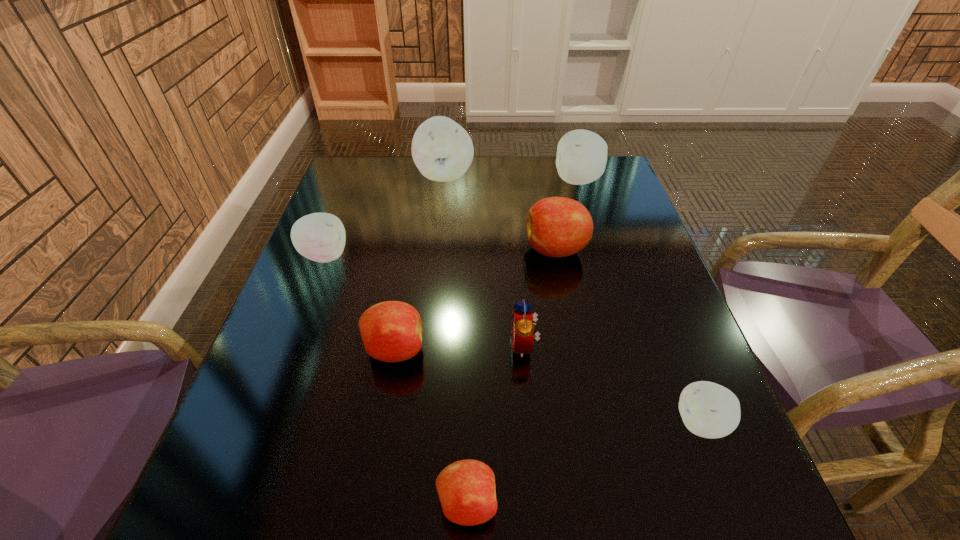
Identify the location of free spot that satisfies the following two spatial constraints: 1. on the front side of the third smallest white apple; 2. on the right side of the second nearest object. Image resolution: width=960 pixels, height=540 pixels. (650, 423).

The image size is (960, 540). Identify the location of vacant point that satisfies the following two spatial constraints: 1. on the front side of the second nearest apple; 2. on the left side of the second nearest red apple. (x=382, y=423).

Find the location of a particular element. free space that satisfies the following two spatial constraints: 1. on the back side of the smallest red apple; 2. on the left side of the second nearest apple is located at coordinates (468, 423).